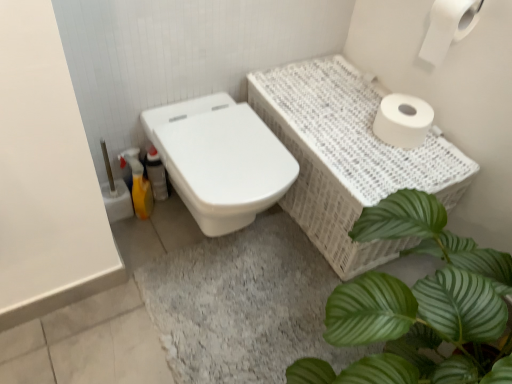
The image size is (512, 384). I want to click on vacant space in front of white matte toilet paper at upper right, which appears as the first toilet paper when ordered from the bottom, so click(404, 166).